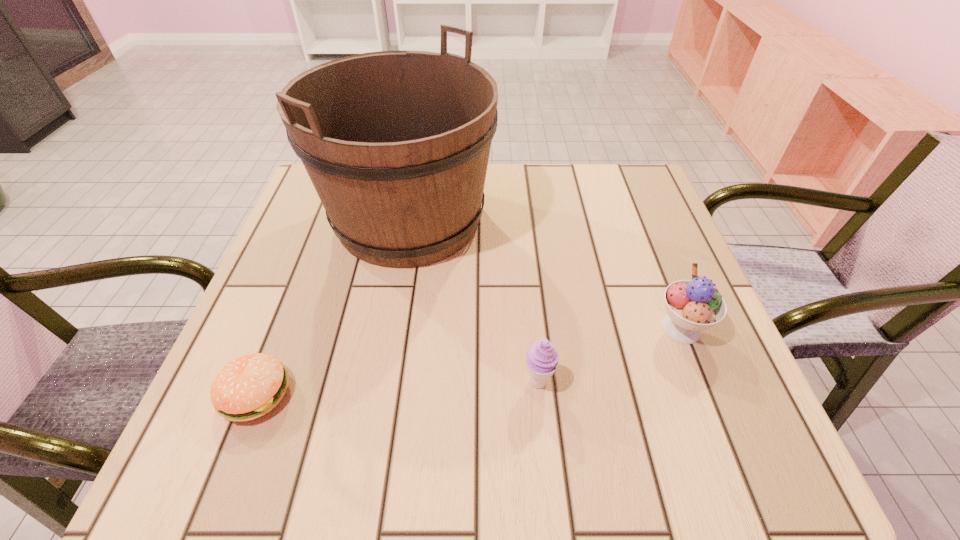
The height and width of the screenshot is (540, 960). Identify the location of vacant region located on the back of the patty. (283, 323).

Where is `object that is at the far edge`? object that is at the far edge is located at coordinates (396, 143).

You are a GUI agent. You are given a task and a screenshot of the screen. Output one action in this format:
    pyautogui.click(x=<x>, y=<y>)
    Task: Click on the object at the near edge
    The height and width of the screenshot is (540, 960).
    Given the screenshot: What is the action you would take?
    pyautogui.click(x=250, y=386)

Locate an element on the screen. This screenshot has width=960, height=540. bucket at the left edge is located at coordinates (396, 143).

This screenshot has height=540, width=960. Identify the location of patty located at the left edge. (250, 386).

Where is `object positioned at the right edge`? The width and height of the screenshot is (960, 540). object positioned at the right edge is located at coordinates point(694,305).

Image resolution: width=960 pixels, height=540 pixels. What are the coordinates of `object positioned at the far left corner` in the screenshot? It's located at (396, 143).

Find the location of a particular element. The height and width of the screenshot is (540, 960). object at the near left corner is located at coordinates (250, 386).

The image size is (960, 540). What are the coordinates of `vacant space at the far edge of the desktop` in the screenshot? It's located at (515, 217).

In the image, there is a desktop. Where is `vacant space at the near edge`? This screenshot has height=540, width=960. vacant space at the near edge is located at coordinates (603, 432).